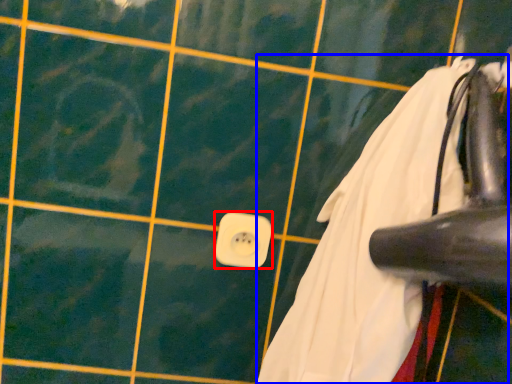
Question: Which of the following is the farthest to the observer, power plugs and sockets (highlighted by a red box) or laundry (highlighted by a blue box)?

Choices:
 (A) power plugs and sockets
 (B) laundry

Answer: (A)